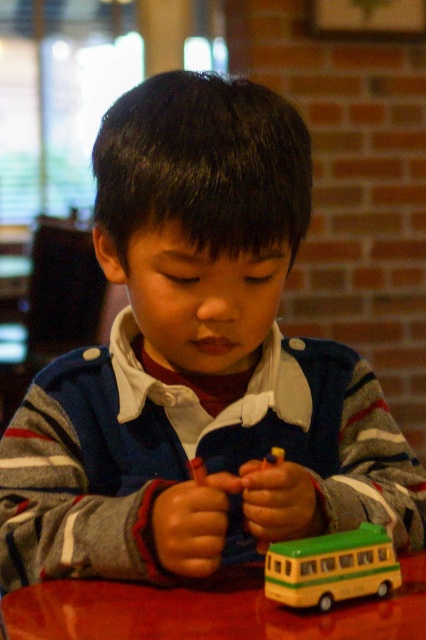
Question: Can you confirm if shiny red table at lower center is positioned above yellow matte bus at lower center?

Choices:
 (A) yes
 (B) no

Answer: (B)

Question: Is shiny red table at lower center in front of yellow matte bus at lower center?

Choices:
 (A) yes
 (B) no

Answer: (A)

Question: Does shiny red table at lower center appear on the right side of yellow matte bus at lower center?

Choices:
 (A) no
 (B) yes

Answer: (A)

Question: Among these objects, which one is nearest to the camera?

Choices:
 (A) shiny red table at lower center
 (B) yellow matte bus at lower center

Answer: (A)

Question: Which point is closer to the camera?

Choices:
 (A) (347, 560)
 (B) (190, 634)

Answer: (B)